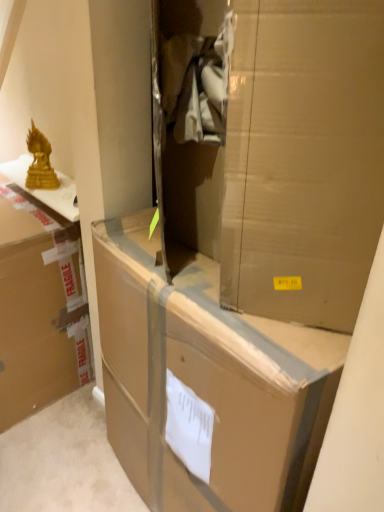
Question: Could you tell me if gold metallic statue at upper left is turned towards cardboard box at center, the first box from the right?

Choices:
 (A) yes
 (B) no

Answer: (B)

Question: Considering the relative sizes of gold metallic statue at upper left and cardboard box at center, the first box from the right, in the image provided, is gold metallic statue at upper left taller than cardboard box at center, the first box from the right,?

Choices:
 (A) yes
 (B) no

Answer: (B)

Question: From the image's perspective, is gold metallic statue at upper left located above cardboard box at center, the first box from the right?

Choices:
 (A) no
 (B) yes

Answer: (B)

Question: Can you confirm if gold metallic statue at upper left is wider than cardboard box at center, which is counted as the second box, starting from the left?

Choices:
 (A) yes
 (B) no

Answer: (B)

Question: Is the depth of gold metallic statue at upper left greater than that of cardboard box at center, the first box from the right?

Choices:
 (A) no
 (B) yes

Answer: (B)

Question: From the image's perspective, is gold metallic statue at upper left positioned above or below brown cardboard box at center?

Choices:
 (A) above
 (B) below

Answer: (A)

Question: Is point (46, 174) closer or farther from the camera than point (327, 282)?

Choices:
 (A) farther
 (B) closer

Answer: (A)

Question: Based on their sizes in the image, would you say gold metallic statue at upper left is bigger or smaller than brown cardboard box at center?

Choices:
 (A) small
 (B) big

Answer: (A)

Question: Considering the positions of gold metallic statue at upper left and brown cardboard box at center in the image, is gold metallic statue at upper left wider or thinner than brown cardboard box at center?

Choices:
 (A) thin
 (B) wide

Answer: (A)

Question: Based on their sizes in the image, would you say brown cardboard box at center is bigger or smaller than gold metallic statue at upper left?

Choices:
 (A) big
 (B) small

Answer: (A)

Question: Is brown cardboard box at center situated inside gold metallic statue at upper left or outside?

Choices:
 (A) inside
 (B) outside

Answer: (B)

Question: From the image's perspective, relative to gold metallic statue at upper left, is brown cardboard box at center above or below?

Choices:
 (A) below
 (B) above

Answer: (A)

Question: Is point (165, 22) positioned closer to the camera than point (34, 146)?

Choices:
 (A) closer
 (B) farther

Answer: (A)

Question: Considering the positions of point (36, 396) and point (34, 159), is point (36, 396) closer or farther from the camera than point (34, 159)?

Choices:
 (A) farther
 (B) closer

Answer: (A)

Question: Which is correct: brown cardboard box at left, the second box when ordered from right to left, is inside gold metallic statue at upper left, or outside of it?

Choices:
 (A) inside
 (B) outside

Answer: (B)